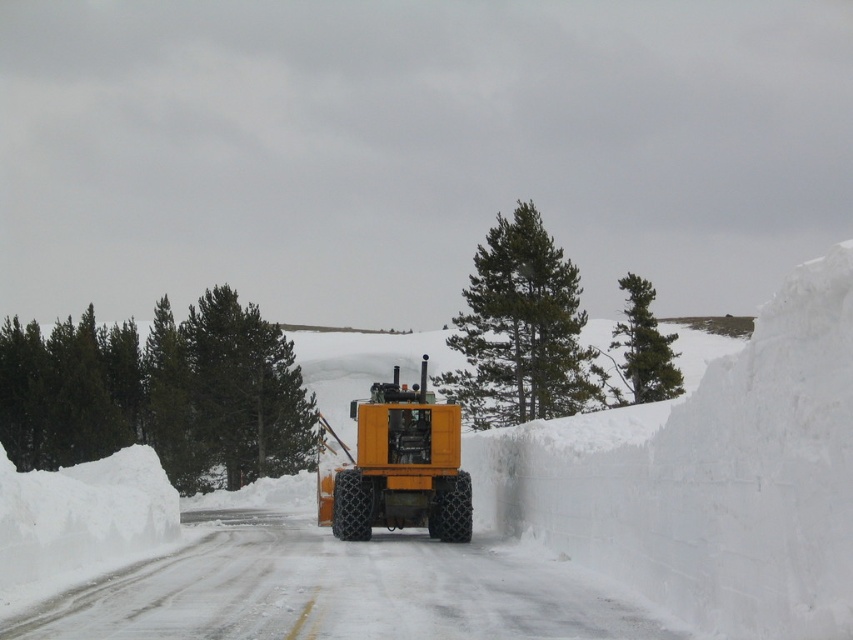
Question: Which point is farther to the camera?

Choices:
 (A) green textured pine at upper right
 (B) yellow rubber tractor at center

Answer: (A)

Question: Estimate the real-world distances between objects in this image. Which object is closer to the green matte pine at left?

Choices:
 (A) green needle-like pine at center
 (B) white fluffy snow at center
 (C) green textured pine at upper right
 (D) yellow rubber tractor at center

Answer: (B)

Question: Considering the relative positions of green needle-like pine at center and green textured pine at upper right in the image provided, where is green needle-like pine at center located with respect to green textured pine at upper right?

Choices:
 (A) left
 (B) right

Answer: (A)

Question: Can you confirm if white fluffy snow at center is wider than green textured pine at upper right?

Choices:
 (A) no
 (B) yes

Answer: (A)

Question: Is green matte pine at left thinner than green textured pine at upper right?

Choices:
 (A) yes
 (B) no

Answer: (A)

Question: Considering the real-world distances, which object is farthest from the green needle-like pine at center?

Choices:
 (A) green textured pine at upper right
 (B) white fluffy snow at center
 (C) yellow rubber tractor at center

Answer: (B)